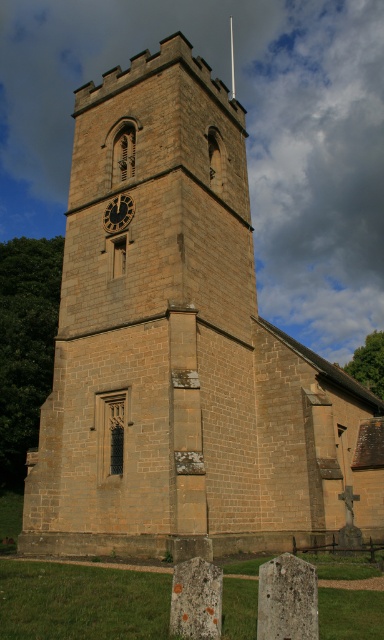
Between dark brown stone clock at center and smooth stone spire at upper center, which one has more height?

smooth stone spire at upper center is taller.

Can you confirm if dark brown stone clock at center is thinner than smooth stone spire at upper center?

Indeed, dark brown stone clock at center has a lesser width compared to smooth stone spire at upper center.

Is point (129, 202) positioned before point (231, 68)?

Yes.

Find the location of a particular element. dark brown stone clock at center is located at coordinates (117, 212).